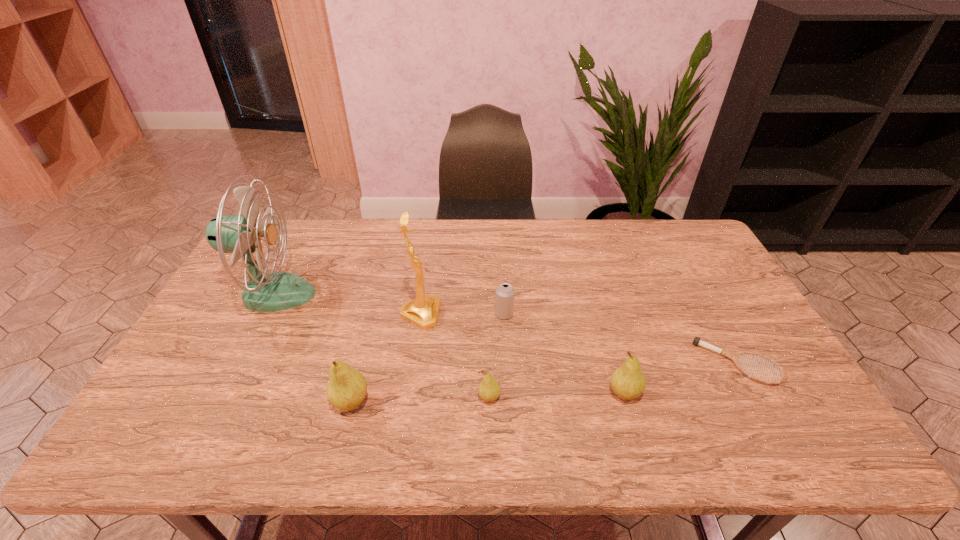
All pears are currently evenly spaced. To continue this pattern, where would you add another pear on the right? Please point out a vacant spot. Please provide its 2D coordinates. Your answer should be formatted as a tuple, i.e. [(x, y)], where the tuple contains the x and y coordinates of a point satisfying the conditions above.

[(757, 390)]